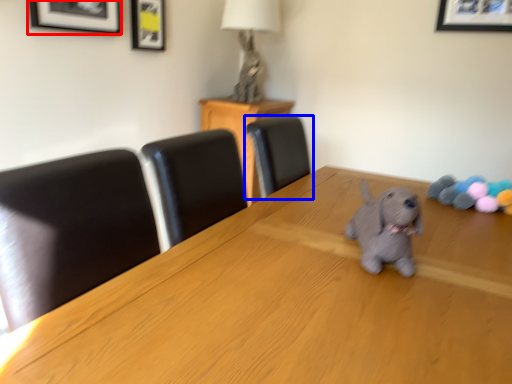
Question: Among these objects, which one is farthest to the camera, picture frame (highlighted by a red box) or chair (highlighted by a blue box)?

Choices:
 (A) picture frame
 (B) chair

Answer: (B)